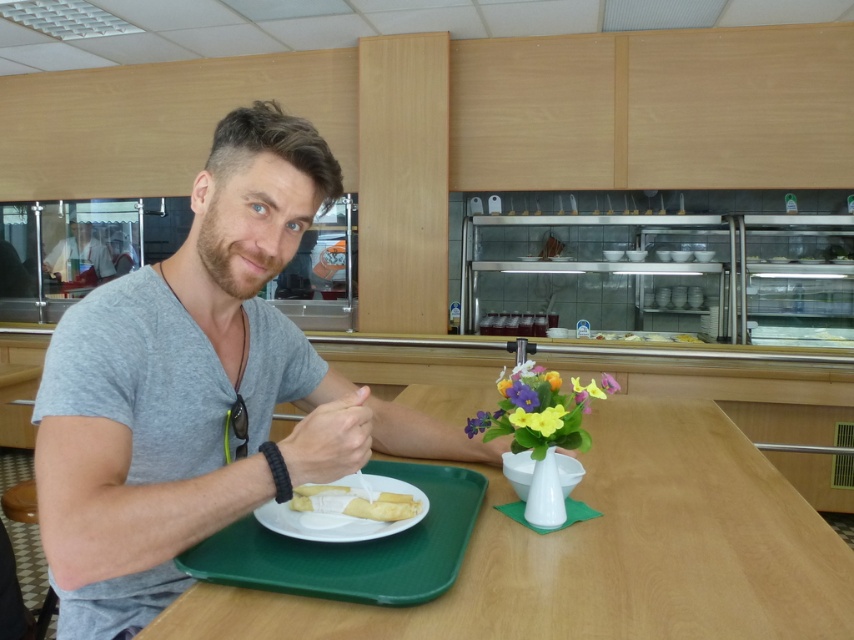
Between gray matte shirt at center and yellow matte flower at center, which one has less height?

Standing shorter between the two is yellow matte flower at center.

Which is behind, point (133, 344) or point (531, 413)?

The point (531, 413) is more distant.

Find the location of a particular element. gray matte shirt at center is located at coordinates (199, 388).

Is gray matte shirt at center to the right of white glossy plate at center from the viewer's perspective?

In fact, gray matte shirt at center is to the left of white glossy plate at center.

Is point (234, 209) positioned after point (268, 524)?

No, it is not.

Locate an element on the screen. This screenshot has height=640, width=854. gray matte shirt at center is located at coordinates tap(199, 388).

Is white glossy plate at center positioned in front of pink matte flower at center?

Yes, white glossy plate at center is closer to the viewer.

Is white glossy plate at center further to camera compared to pink matte flower at center?

No, white glossy plate at center is in front of pink matte flower at center.

Identify the location of white glossy plate at center. (341, 520).